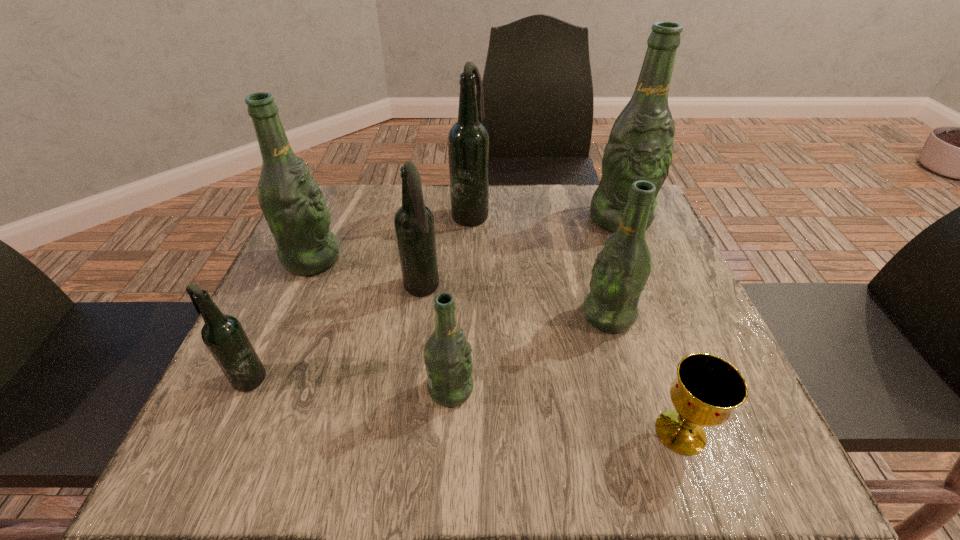
Where is `free space that satisfies the following two spatial constraints: 1. on the surface of the biggest green beer bottle; 2. on the surface of the third farthest green beer bottle`? Image resolution: width=960 pixels, height=540 pixels. free space that satisfies the following two spatial constraints: 1. on the surface of the biggest green beer bottle; 2. on the surface of the third farthest green beer bottle is located at coordinates (659, 316).

At what (x,y) coordinates should I click in order to perform the action: click on vacant region that satisfies the following two spatial constraints: 1. on the surface of the leftmost green beer bottle; 2. on the back side of the shortest object. Please return your answer as a coordinate pair (x, y). This screenshot has width=960, height=540. Looking at the image, I should click on (238, 432).